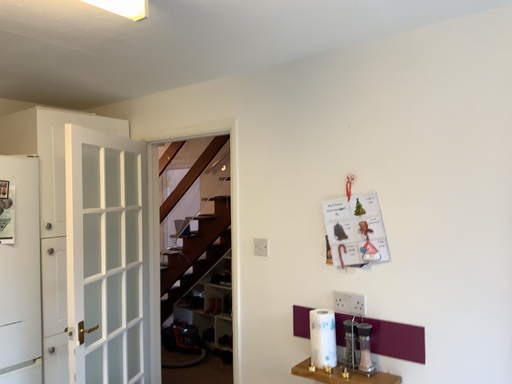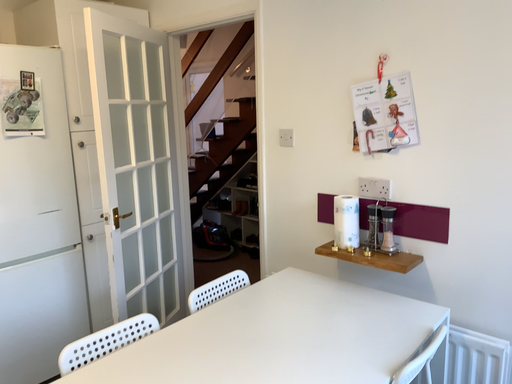
Question: Which way did the camera rotate in the video?

Choices:
 (A) rotated downward
 (B) rotated upward

Answer: (A)